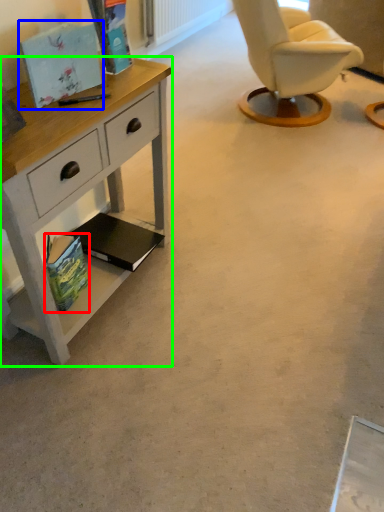
Question: Which object is positioned farthest from magazine (highlighted by a red box)? Select from magazine (highlighted by a blue box) and desk (highlighted by a green box).

Choices:
 (A) magazine
 (B) desk

Answer: (A)